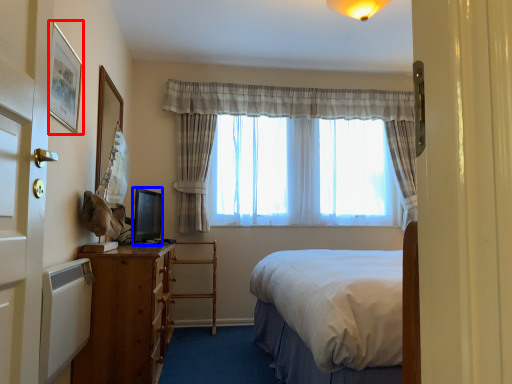
Question: Among these objects, which one is farthest to the camera, picture frame (highlighted by a red box) or television (highlighted by a blue box)?

Choices:
 (A) picture frame
 (B) television

Answer: (B)